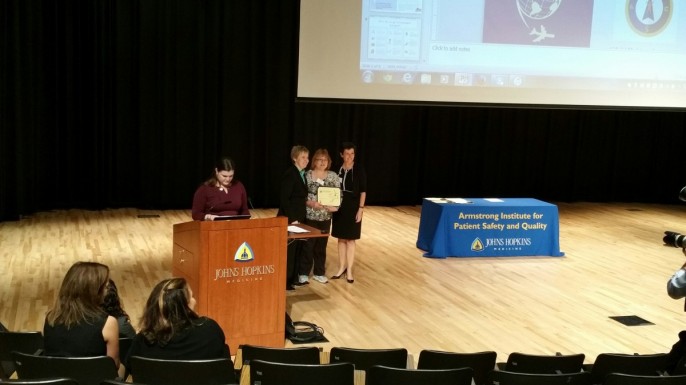
Where is `image of the presentation on the screen`? image of the presentation on the screen is located at coordinates (496, 54).